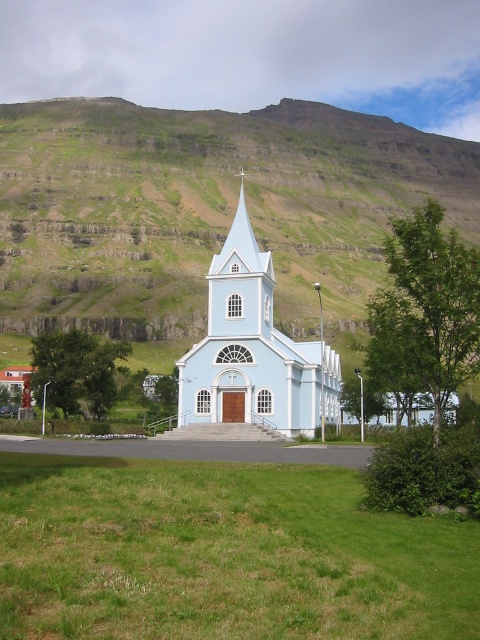
Question: Among these points, which one is farthest from the camera?

Choices:
 (A) (68, 132)
 (B) (244, 236)
 (C) (175, 484)

Answer: (A)

Question: From the image, what is the correct spatial relationship of green grassy hillside at upper center in relation to light blue painted wood church at center?

Choices:
 (A) right
 (B) left

Answer: (B)

Question: Estimate the real-world distances between objects in this image. Which object is farther from the green grass at lower left?

Choices:
 (A) light blue painted wood church at center
 (B) green grassy hillside at upper center

Answer: (B)

Question: Based on their relative distances, which object is nearer to the light blue painted wood church at center?

Choices:
 (A) green grass at lower left
 (B) green grassy hillside at upper center

Answer: (A)

Question: Can you confirm if green grassy hillside at upper center is positioned above green grass at lower left?

Choices:
 (A) yes
 (B) no

Answer: (A)

Question: Does green grassy hillside at upper center have a smaller size compared to light blue painted wood church at center?

Choices:
 (A) no
 (B) yes

Answer: (A)